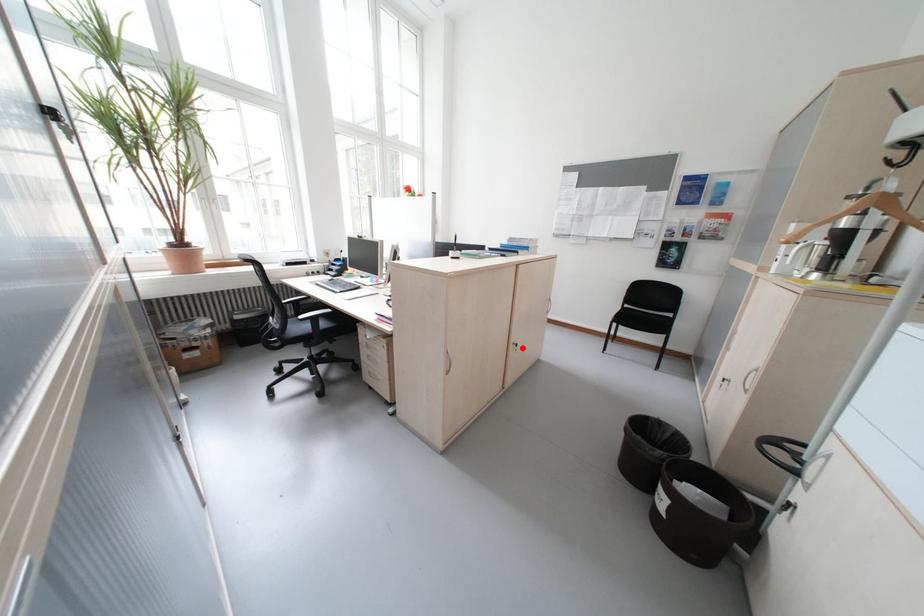
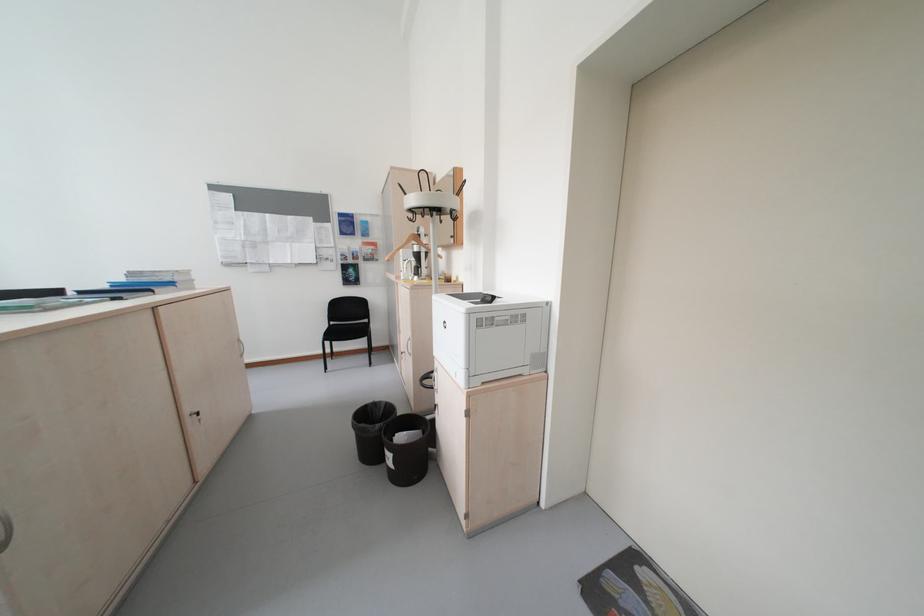
In the second image, find the point that corresponds to the highlighted location in the first image.

(200, 421)